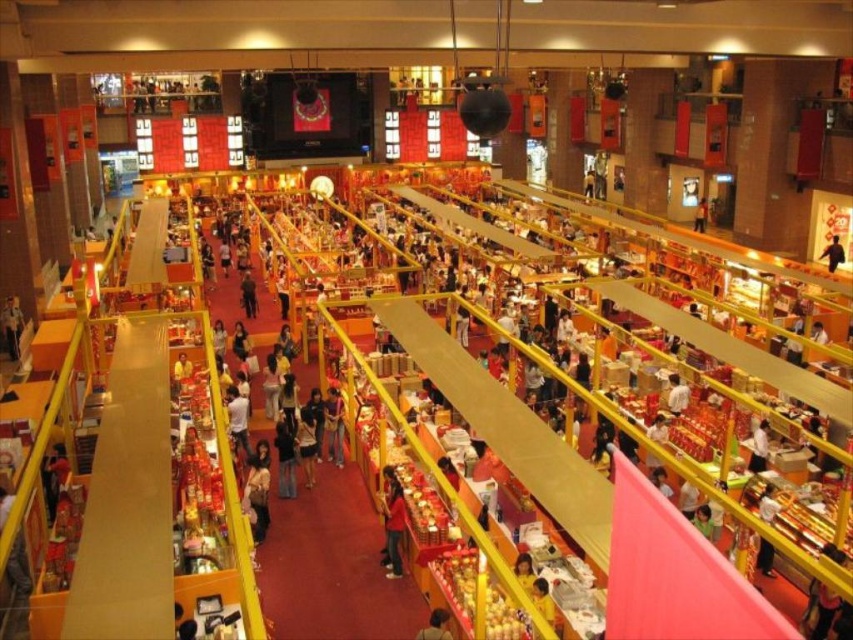
Describe the element at coordinates (759, 448) in the screenshot. This screenshot has width=853, height=640. I see `white fabric shirt at center` at that location.

Is point (752, 468) farther from viewer compared to point (436, 636)?

Yes, point (752, 468) is behind point (436, 636).

Locate an element on the screen. The image size is (853, 640). white fabric shirt at center is located at coordinates (759, 448).

Can you confirm if smooth black hair at lower center is taller than black leather jacket at center?

Incorrect, smooth black hair at lower center's height is not larger of black leather jacket at center's.

Does smooth black hair at lower center have a smaller size compared to black leather jacket at center?

Yes.

Does point (440, 620) lie behind point (827, 253)?

No, (440, 620) is in front of (827, 253).

Identify the location of smooth black hair at lower center. Image resolution: width=853 pixels, height=640 pixels. (434, 625).

Which is behind, point (397, 504) or point (772, 576)?

Positioned behind is point (397, 504).

Does red matte shirt at center appear under white fabric shirt at lower right?

Correct, red matte shirt at center is located below white fabric shirt at lower right.

Locate an element on the screen. This screenshot has width=853, height=640. red matte shirt at center is located at coordinates (392, 524).

Locate an element on the screen. Image resolution: width=853 pixels, height=640 pixels. red matte shirt at center is located at coordinates (392, 524).